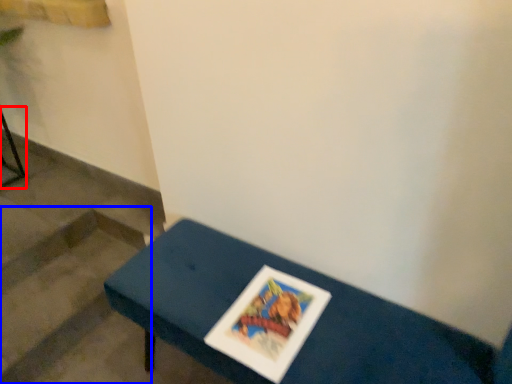
Question: Among these objects, which one is nearest to the camera, furniture (highlighted by a red box) or stairwell (highlighted by a blue box)?

Choices:
 (A) furniture
 (B) stairwell

Answer: (B)